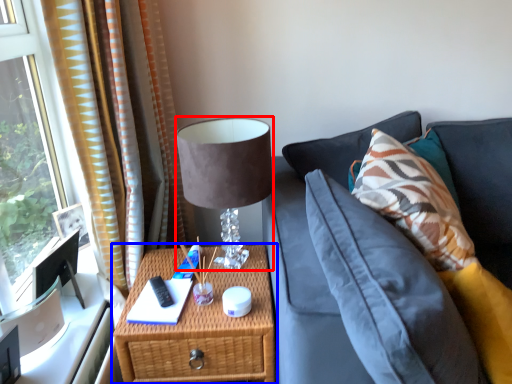
Question: Which object is closer to the camera taking this photo, table lamp (highlighted by a red box) or nightstand (highlighted by a blue box)?

Choices:
 (A) table lamp
 (B) nightstand

Answer: (A)